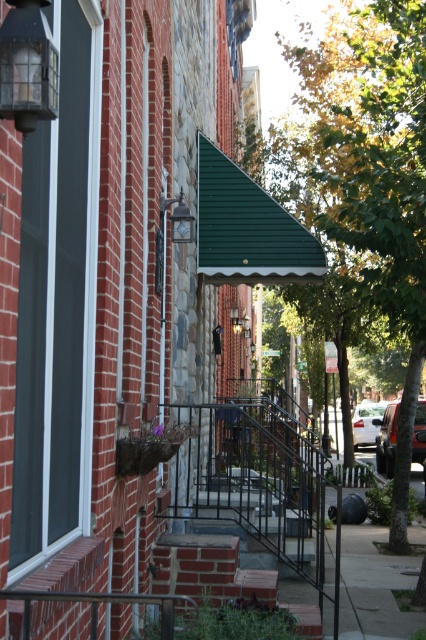
You are standing on the sidewalk in front of the buildings and looking towards the green corrugated awning at center. Can you see the clear glass lantern at upper left from this position?

The clear glass lantern at upper left is behind the green corrugated awning at center, so it is obstructed and not visible from the sidewalk in front of the buildings.

You are a delivery person trying to navigate through the narrow alley between the buildings. You see the green leafy tree at center and the clear glass lantern at upper left. Which object is higher up in the scene?

The green leafy tree at center is located above the clear glass lantern at upper left, so the green leafy tree at center is higher up in the scene.

You are a window cleaner standing on a ladder. You need to clean both the green leafy tree at center and the clear glass lantern at upper left. Which object will require you to climb higher on the ladder?

The green leafy tree at center requires climbing higher because it has a greater height compared to the clear glass lantern at upper left.